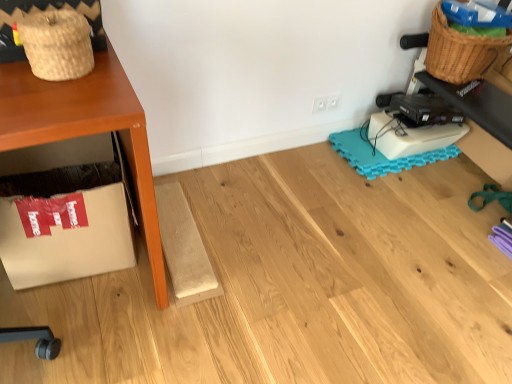
Question: Looking at their shapes, would you say teal foam mat at lower right is wider or thinner than woven straw basket at upper left, which is counted as the second basket, starting from the right?

Choices:
 (A) thin
 (B) wide

Answer: (B)

Question: Would you say teal foam mat at lower right is inside or outside woven straw basket at upper left, which is counted as the second basket, starting from the right?

Choices:
 (A) inside
 (B) outside

Answer: (B)

Question: Which of these objects is positioned farthest from the woven brown basket at upper right, the first basket in the top-to-bottom sequence?

Choices:
 (A) teal foam mat at lower right
 (B) woven straw basket at upper left, marked as the first basket in a front-to-back arrangement
 (C) white cardboard box at lower left

Answer: (C)

Question: Which is farther from the woven brown basket at upper right, which is the 1th basket in right-to-left order?

Choices:
 (A) woven straw basket at upper left, which is the first basket from left to right
 (B) white cardboard box at lower left
 (C) teal foam mat at lower right

Answer: (B)